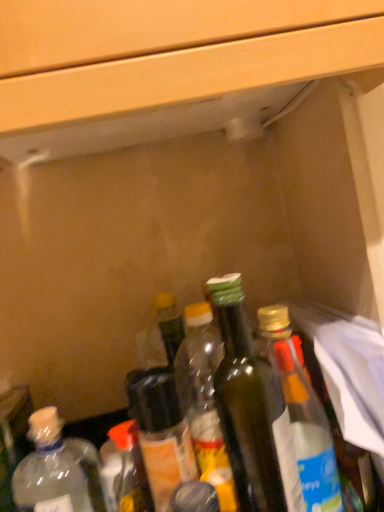
Question: From a real-world perspective, does translucent plastic bottle at center, placed as the 3th bottle when sorted from left to right, sit lower than green glass bottle at center, which is the 2th bottle in right-to-left order?

Choices:
 (A) yes
 (B) no

Answer: (A)

Question: Is the position of translucent plastic bottle at center, the fourth bottle positioned from the right, less distant than that of green glass bottle at center, which is the 2th bottle in right-to-left order?

Choices:
 (A) yes
 (B) no

Answer: (B)

Question: Does translucent plastic bottle at center, the fourth bottle positioned from the right, turn towards green glass bottle at center, which is the fifth bottle in left-to-right order?

Choices:
 (A) no
 (B) yes

Answer: (A)

Question: Does translucent plastic bottle at center, placed as the 3th bottle when sorted from left to right, have a smaller size compared to green glass bottle at center, which is the fifth bottle in left-to-right order?

Choices:
 (A) yes
 (B) no

Answer: (A)

Question: Is translucent plastic bottle at center, placed as the 3th bottle when sorted from left to right, oriented away from green glass bottle at center, which is the 2th bottle in right-to-left order?

Choices:
 (A) yes
 (B) no

Answer: (B)

Question: In terms of size, does clear plastic bottle at lower left, the 6th bottle in the right-to-left sequence, appear bigger or smaller than green glass bottle at center, which is the 2th bottle in right-to-left order?

Choices:
 (A) big
 (B) small

Answer: (B)

Question: Is clear plastic bottle at lower left, acting as the 1th bottle starting from the left, wider or thinner than green glass bottle at center, which is the 2th bottle in right-to-left order?

Choices:
 (A) wide
 (B) thin

Answer: (B)

Question: Is clear plastic bottle at lower left, the 6th bottle in the right-to-left sequence, inside or outside of green glass bottle at center, which is the fifth bottle in left-to-right order?

Choices:
 (A) outside
 (B) inside

Answer: (A)

Question: From a real-world perspective, relative to green glass bottle at center, which is the fifth bottle in left-to-right order, is clear plastic bottle at lower left, the 6th bottle in the right-to-left sequence, vertically above or below?

Choices:
 (A) below
 (B) above

Answer: (A)

Question: From a real-world perspective, relative to translucent plastic bottle at lower left, arranged as the 5th bottle when viewed from the right, is clear plastic bottle at lower left, the 6th bottle in the right-to-left sequence, vertically above or below?

Choices:
 (A) above
 (B) below

Answer: (A)

Question: Choose the correct answer: Is clear plastic bottle at lower left, acting as the 1th bottle starting from the left, inside translucent plastic bottle at lower left, arranged as the 5th bottle when viewed from the right, or outside it?

Choices:
 (A) outside
 (B) inside

Answer: (A)

Question: Is clear plastic bottle at lower left, the 6th bottle in the right-to-left sequence, in front of or behind translucent plastic bottle at lower left, arranged as the 5th bottle when viewed from the right, in the image?

Choices:
 (A) front
 (B) behind

Answer: (A)

Question: From the image's perspective, is clear plastic bottle at lower left, the 6th bottle in the right-to-left sequence, positioned above or below translucent plastic bottle at lower left, the 2th bottle from the left?

Choices:
 (A) below
 (B) above

Answer: (B)

Question: Is green glass bottle at center, which is the 2th bottle in right-to-left order, taller or shorter than translucent plastic bottle at center, the fourth bottle positioned from the right?

Choices:
 (A) tall
 (B) short

Answer: (A)

Question: Is point (291, 440) positioned closer to the camera than point (148, 377)?

Choices:
 (A) closer
 (B) farther

Answer: (A)